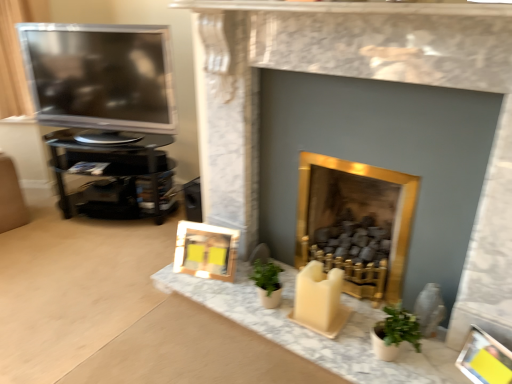
Question: Considering the relative sizes of matte gray vase at lower right and satin black television at left in the image provided, is matte gray vase at lower right smaller than satin black television at left?

Choices:
 (A) no
 (B) yes

Answer: (B)

Question: Is matte gray vase at lower right looking in the opposite direction of satin black television at left?

Choices:
 (A) no
 (B) yes

Answer: (A)

Question: Does matte gray vase at lower right have a lesser width compared to satin black television at left?

Choices:
 (A) yes
 (B) no

Answer: (A)

Question: Is matte gray vase at lower right completely or partially outside of satin black television at left?

Choices:
 (A) no
 (B) yes

Answer: (B)

Question: Is matte gray vase at lower right oriented towards satin black television at left?

Choices:
 (A) yes
 (B) no

Answer: (B)

Question: Considering the positions of satin black television at left and matte gray vase at lower right in the image, is satin black television at left bigger or smaller than matte gray vase at lower right?

Choices:
 (A) small
 (B) big

Answer: (B)

Question: Is satin black television at left spatially inside matte gray vase at lower right, or outside of it?

Choices:
 (A) inside
 (B) outside

Answer: (B)

Question: From the image's perspective, is satin black television at left above or below matte gray vase at lower right?

Choices:
 (A) above
 (B) below

Answer: (A)

Question: Relative to matte gray vase at lower right, is satin black television at left in front or behind?

Choices:
 (A) behind
 (B) front

Answer: (A)

Question: From a real-world perspective, is yellow paper picture frame at lower right, which is counted as the 2th picture frame, starting from the top, above or below matte gray vase at lower right?

Choices:
 (A) above
 (B) below

Answer: (B)

Question: From the image's perspective, is yellow paper picture frame at lower right, which is counted as the 1th picture frame, starting from the right, above or below matte gray vase at lower right?

Choices:
 (A) above
 (B) below

Answer: (B)

Question: Considering their positions, is yellow paper picture frame at lower right, acting as the 1th picture frame starting from the bottom, located in front of or behind matte gray vase at lower right?

Choices:
 (A) behind
 (B) front

Answer: (B)

Question: Is yellow paper picture frame at lower right, placed as the 2th picture frame when sorted from left to right, to the left or to the right of matte gray vase at lower right in the image?

Choices:
 (A) right
 (B) left

Answer: (A)

Question: In terms of width, does satin black television at left look wider or thinner when compared to wooden frame at lower center, which is counted as the 1th picture frame, starting from the top?

Choices:
 (A) thin
 (B) wide

Answer: (B)

Question: Is satin black television at left in front of or behind wooden frame at lower center, which is the 2th picture frame in bottom-to-top order, in the image?

Choices:
 (A) behind
 (B) front

Answer: (A)